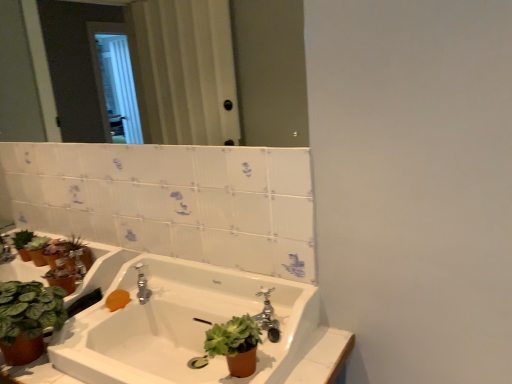
Image resolution: width=512 pixels, height=384 pixels. I want to click on vacant space to the right of green matte succulent at lower center, so click(309, 362).